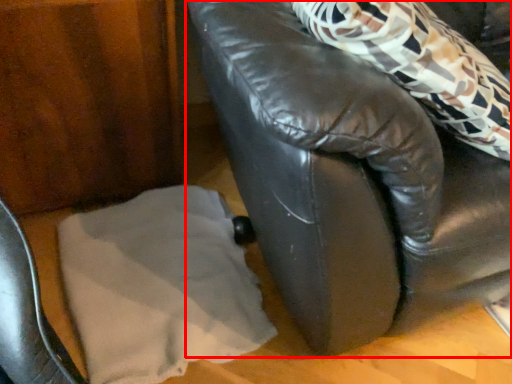
Question: From the image's perspective, considering the relative positions of furniture (annotated by the red box) and linen in the image provided, where is furniture (annotated by the red box) located with respect to the staircase?

Choices:
 (A) below
 (B) above

Answer: (B)